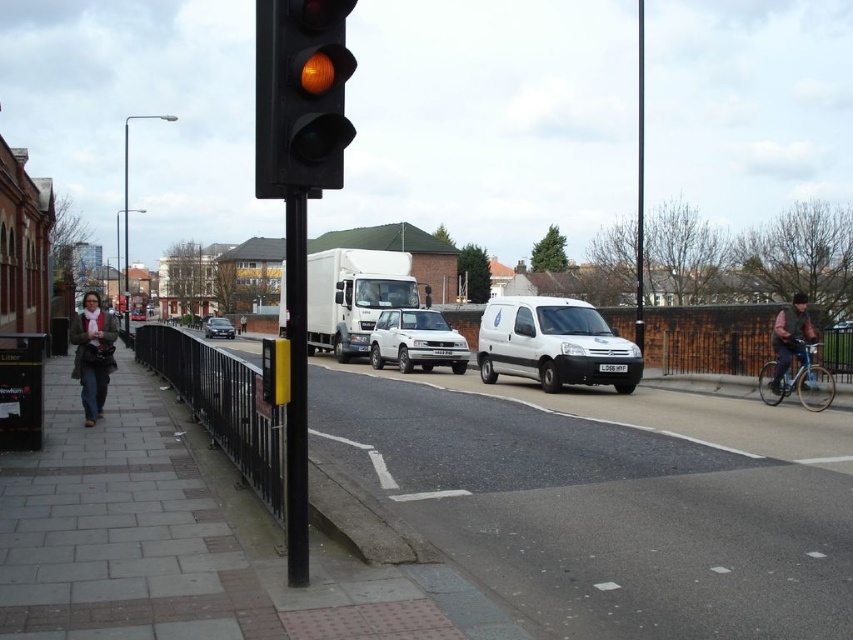
You are a pedestrian standing on the sidewalk next to the black metal pole at center. You want to cross the road to reach the dark brown leather jacket at right. Is the pole between you and the jacket?

The black metal pole at center is positioned over the dark brown leather jacket at right, meaning the pole is directly above the jacket. Since you are standing next to the pole, the pole is not between you and the jacket but rather above it, so you can walk straight towards the jacket without obstruction from the pole.

You are a pedestrian standing on the sidewalk. You see the paved sidewalk at lower left and the white matte car at center. Which object is closer to you?

The paved sidewalk at lower left is closer to you because it is positioned in front of the white matte car at center.

You are a delivery person standing at the black metal pole at center, and you need to deliver a package to the dark brown leather jacket at right. The delivery robot you use has a maximum range of 30 meters. Can the robot reach the destination?

The distance between the black metal pole at center and the dark brown leather jacket at right is 27.47 meters, which is within the robot maximum range of 30 meters. The robot can reach the destination.